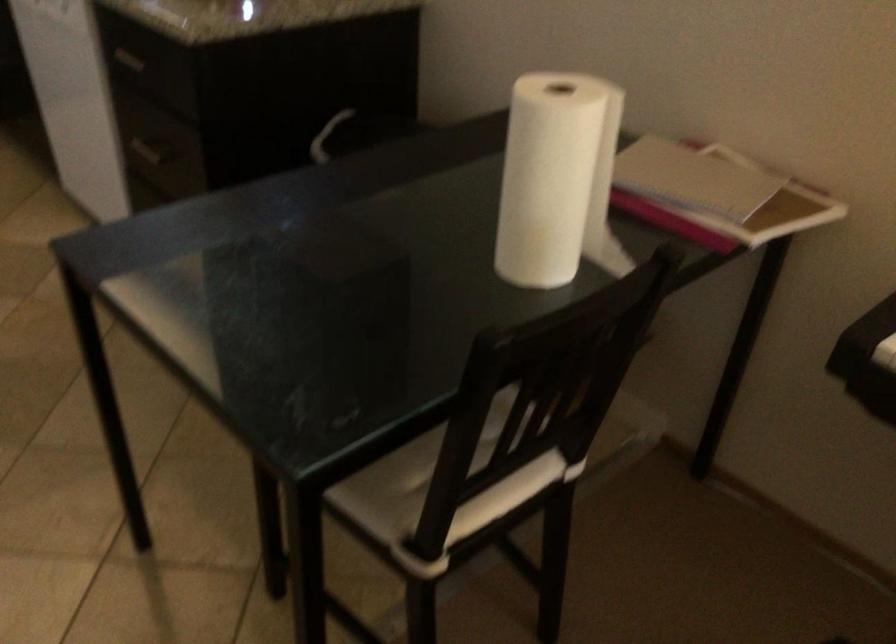
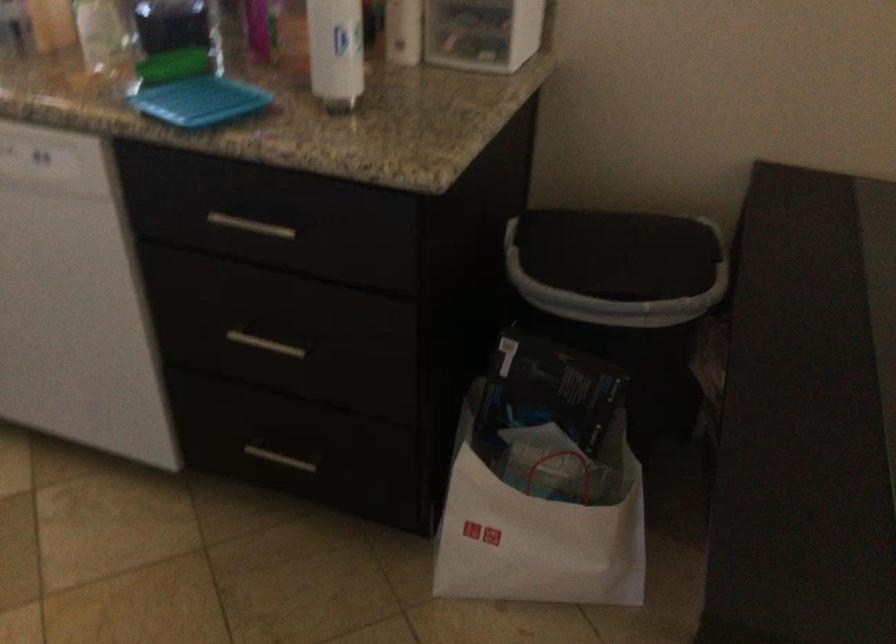
Which direction would the cameraman need to move to produce the second image?

The cameraman moved toward left, forward.